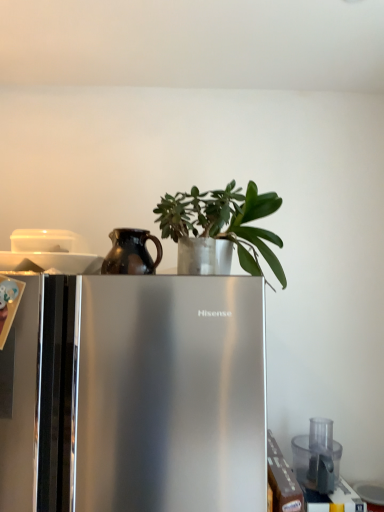
Question: From a real-world perspective, is green matte plant at center positioned above or below brown matte jug at upper left?

Choices:
 (A) above
 (B) below

Answer: (A)

Question: Considering the positions of green matte plant at center and brown matte jug at upper left in the image, is green matte plant at center bigger or smaller than brown matte jug at upper left?

Choices:
 (A) big
 (B) small

Answer: (A)

Question: Estimate the real-world distances between objects in this image. Which object is closer to the satin silver refrigerator at center?

Choices:
 (A) brown matte jug at upper left
 (B) transparent plastic food processor at lower right
 (C) green matte plant at center

Answer: (A)

Question: Estimate the real-world distances between objects in this image. Which object is closer to the brown matte jug at upper left?

Choices:
 (A) green matte plant at center
 (B) satin silver refrigerator at center
 (C) transparent plastic food processor at lower right

Answer: (A)